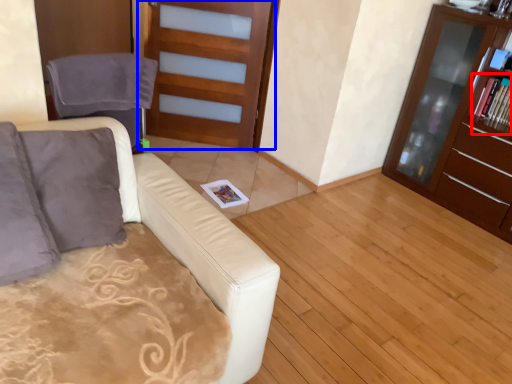
Question: Which object is further to the camera taking this photo, magazine (highlighted by a red box) or door (highlighted by a blue box)?

Choices:
 (A) magazine
 (B) door

Answer: (B)